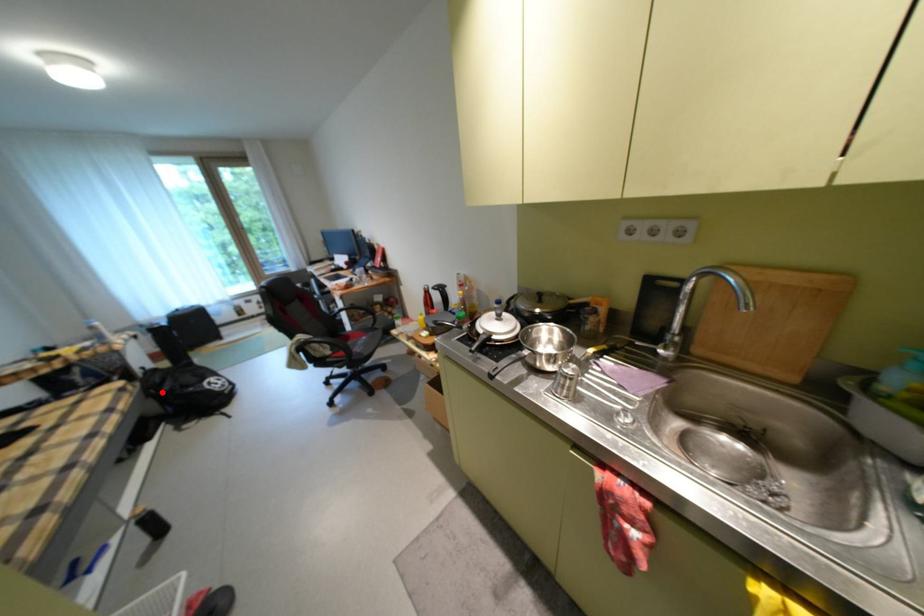
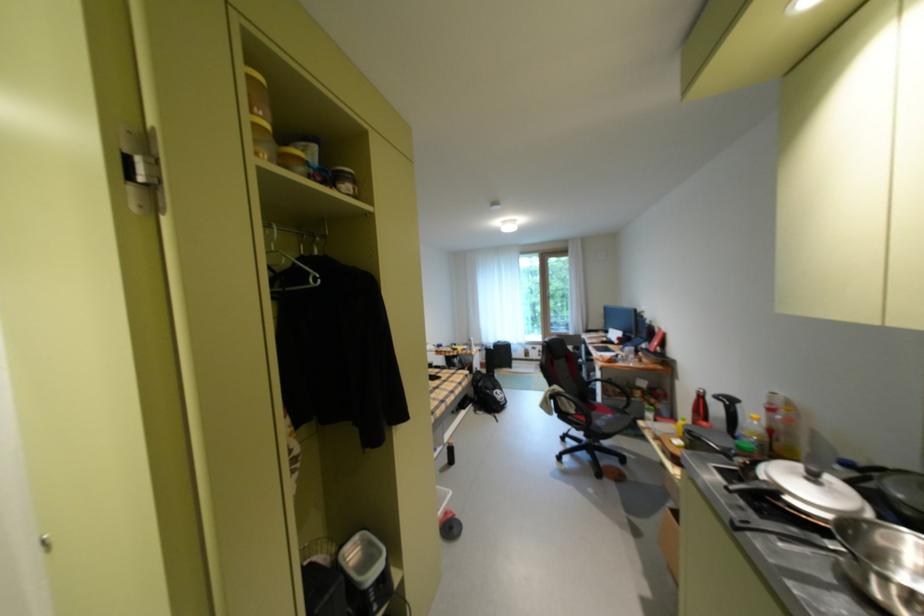
Question: I am providing you with two images of the same scene from different viewpoints. Given a red point in image1, look at the same physical point in image2. Is it:

Choices:
 (A) Closer to the viewpoint
 (B) Farther from the viewpoint

Answer: (B)